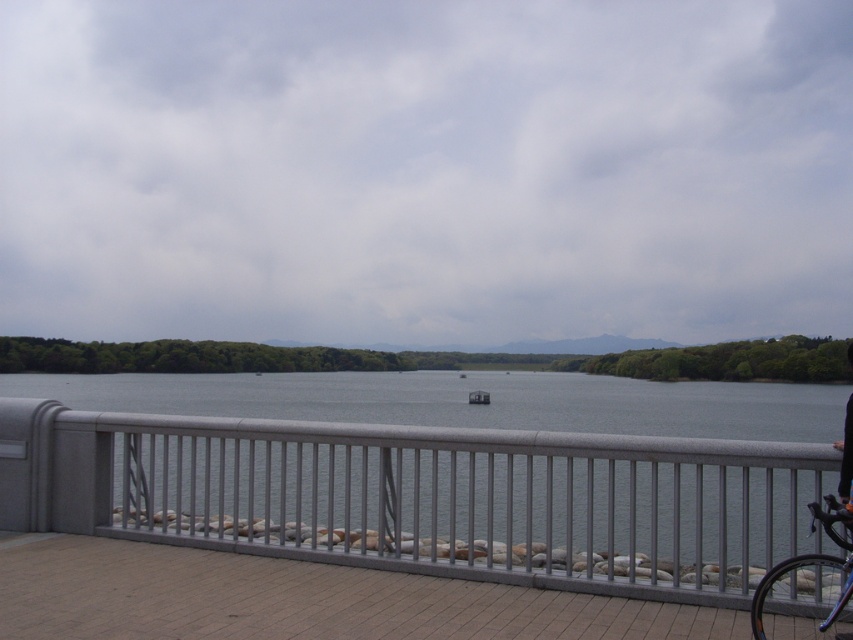
Between satin silver railing at center and shiny black bicycle at right, which one appears on the left side from the viewer's perspective?

satin silver railing at center is more to the left.

Is satin silver railing at center bigger than shiny black bicycle at right?

Yes.

I want to click on satin silver railing at center, so click(425, 497).

Locate an element on the screen. The image size is (853, 640). satin silver railing at center is located at coordinates (425, 497).